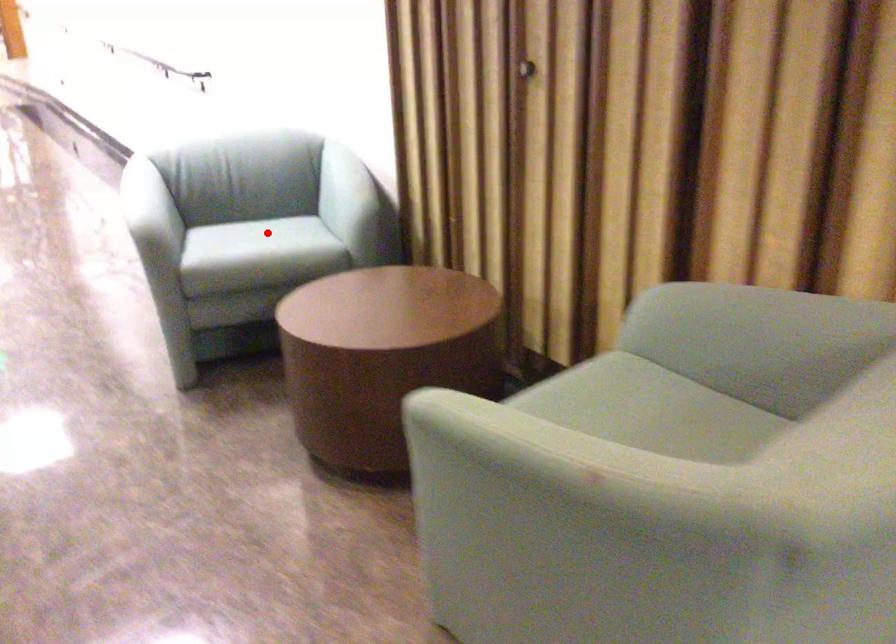
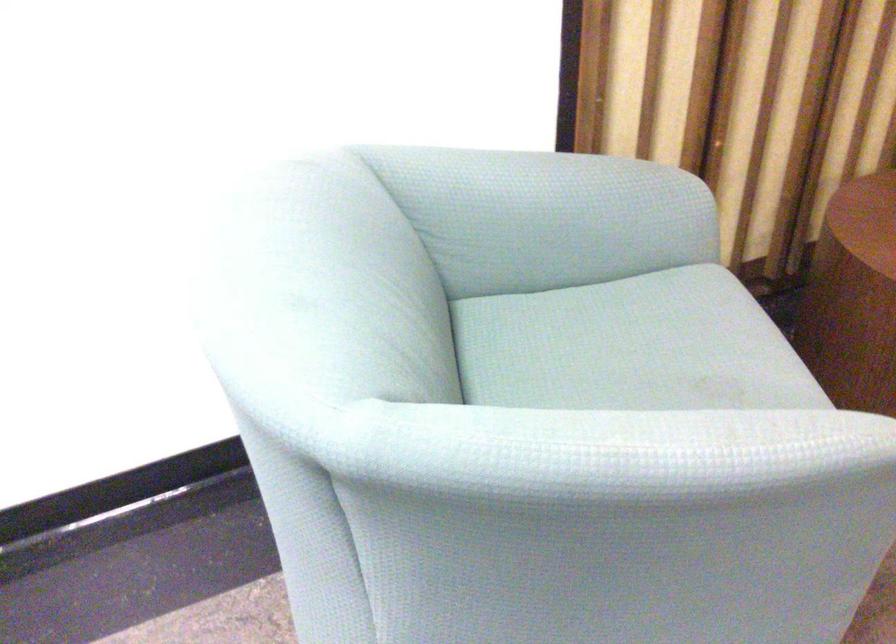
Find the pixel in the second image that matches the highlighted location in the first image.

(631, 346)